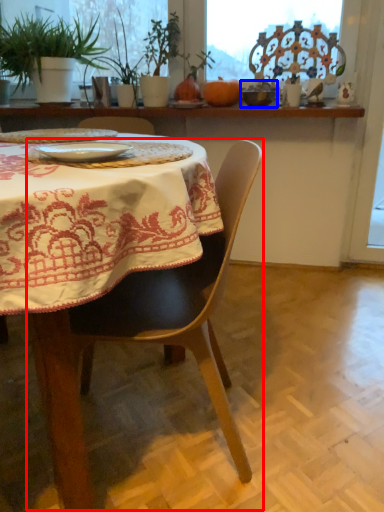
Question: Which point is closer to the camera, chair (highlighted by a red box) or tableware (highlighted by a blue box)?

Choices:
 (A) chair
 (B) tableware

Answer: (A)